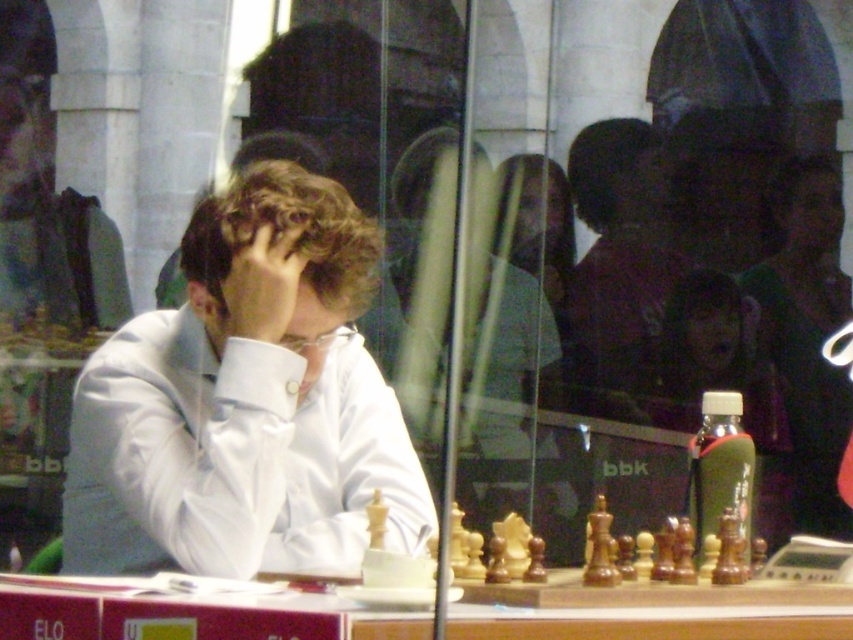
Is white glossy shirt at center to the left of wooden at center from the viewer's perspective?

Indeed, white glossy shirt at center is positioned on the left side of wooden at center.

Which of these two, white glossy shirt at center or wooden at center, stands shorter?

With less height is wooden at center.

Who is more distant from viewer, (244, 452) or (230, 627)?

Point (244, 452)

This screenshot has height=640, width=853. Find the location of `white glossy shirt at center`. white glossy shirt at center is located at coordinates (244, 401).